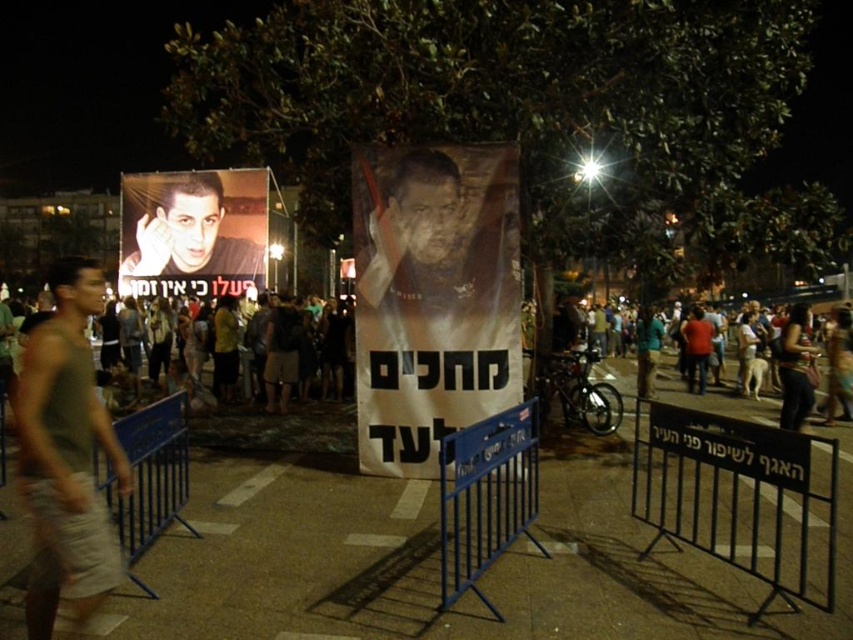
Which is behind, point (245, 259) or point (444, 534)?

The point (245, 259) is behind.

Is matte plastic poster at upper left above blue metal barricade at center?

Indeed, matte plastic poster at upper left is positioned over blue metal barricade at center.

This screenshot has width=853, height=640. In order to click on matte plastic poster at upper left in this screenshot , I will do [193, 232].

Is the position of metallic poster at center less distant than that of dark brown leather jacket at lower right?

Yes, metallic poster at center is closer to the viewer.

Is metallic poster at center thinner than dark brown leather jacket at lower right?

No.

Is point (364, 346) in front of point (805, 412)?

That is True.

This screenshot has width=853, height=640. I want to click on metallic poster at center, so click(433, 298).

Who is shorter, green fabric tank top at left or blue metal barricade at lower left?

blue metal barricade at lower left

How distant is green fabric tank top at left from blue metal barricade at lower left?

They are 7.16 feet apart.

Is point (79, 364) farther from camera compared to point (115, 515)?

No, (79, 364) is in front of (115, 515).

Find the location of a particular element. green fabric tank top at left is located at coordinates (65, 456).